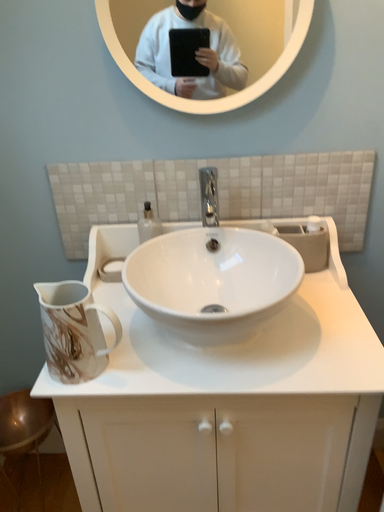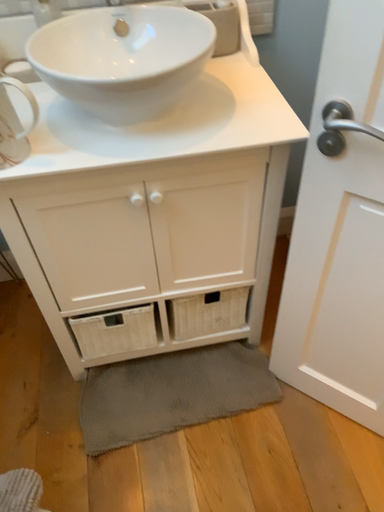
Question: Which way did the camera rotate in the video?

Choices:
 (A) rotated upward
 (B) rotated downward

Answer: (B)